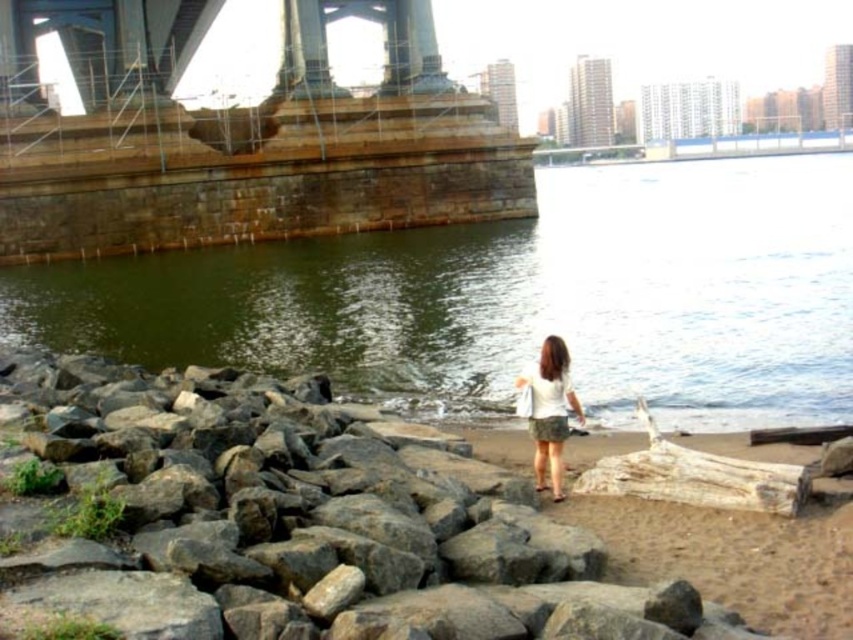
Does green stone river at center appear over gray rock at lower center?

Yes.

Does point (711, 250) lie behind point (26, 611)?

Yes.

The width and height of the screenshot is (853, 640). Identify the location of green stone river at center. (515, 298).

What are the coordinates of `gray rock at lower center` in the screenshot? It's located at (282, 522).

In the scene shown: Which of these two, gray rock at lower center or white fabric skirt at lower right, stands shorter?

white fabric skirt at lower right is shorter.

The image size is (853, 640). In order to click on gray rock at lower center in this screenshot , I will do `click(282, 522)`.

Can you confirm if green stone river at center is smaller than white fabric skirt at lower right?

Actually, green stone river at center might be larger than white fabric skirt at lower right.

Which is in front, point (357, 264) or point (560, 376)?

Point (560, 376)

Is point (276, 352) positioned after point (549, 388)?

Yes, point (276, 352) is farther from viewer.

You are a GUI agent. You are given a task and a screenshot of the screen. Output one action in this format:
    pyautogui.click(x=<x>, y=<y>)
    Task: Click on the green stone river at center
    Image resolution: width=853 pixels, height=640 pixels.
    Given the screenshot: What is the action you would take?
    pyautogui.click(x=515, y=298)